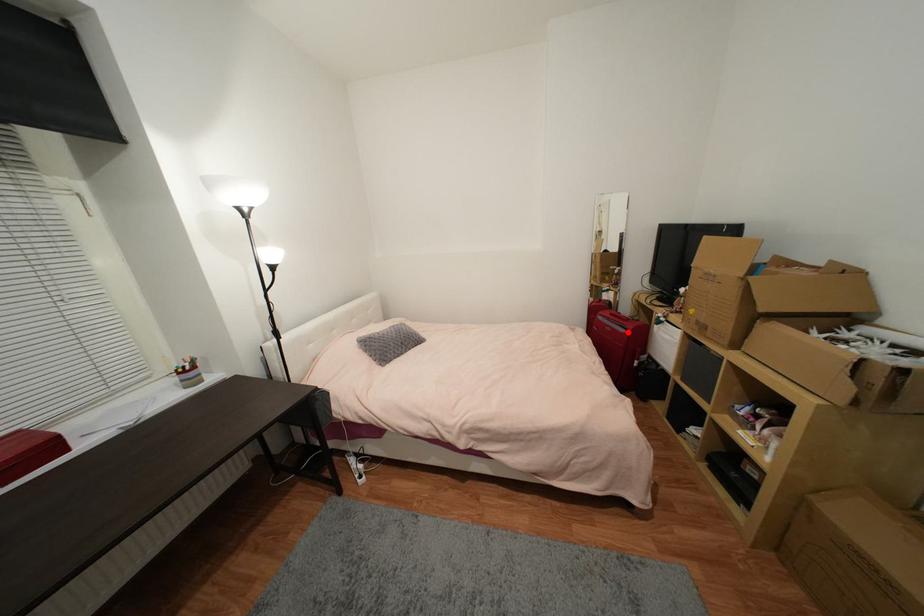
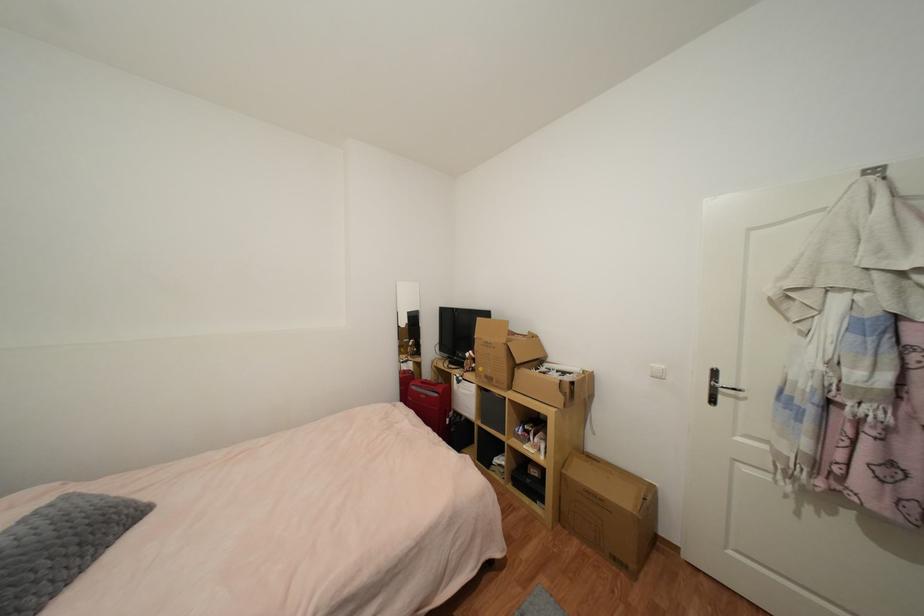
Question: I am providing you with two images of the same scene from different viewpoints. A red point is shown in image1. For the corresponding object point in image2, is it positioned nearer or farther from the camera?

Choices:
 (A) Nearer
 (B) Farther

Answer: (B)